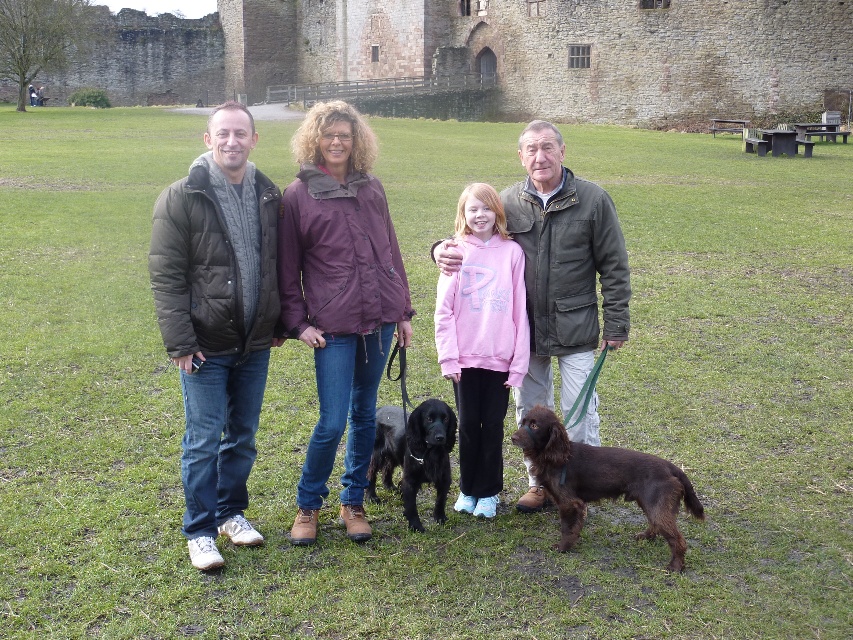
Question: Can you confirm if matte black jacket at center is bigger than brown furry dog at lower right?

Choices:
 (A) yes
 (B) no

Answer: (A)

Question: Which object appears closest to the camera in this image?

Choices:
 (A) brown furry dog at lower right
 (B) purple matte jacket at center
 (C) stone wall at upper center

Answer: (A)

Question: Considering the relative positions of purple matte jacket at center and pink fleece at center in the image provided, where is purple matte jacket at center located with respect to pink fleece at center?

Choices:
 (A) left
 (B) right

Answer: (A)

Question: Considering the real-world distances, which object is closest to the stone wall at upper center?

Choices:
 (A) dark brown leather jacket at center
 (B) matte black jacket at center
 (C) black smooth coat dog at center

Answer: (C)

Question: Which point is farther to the camera?

Choices:
 (A) (345, 340)
 (B) (538, 476)

Answer: (A)

Question: Can you confirm if matte black jacket at center is positioned to the left of dark brown leather jacket at center?

Choices:
 (A) yes
 (B) no

Answer: (A)